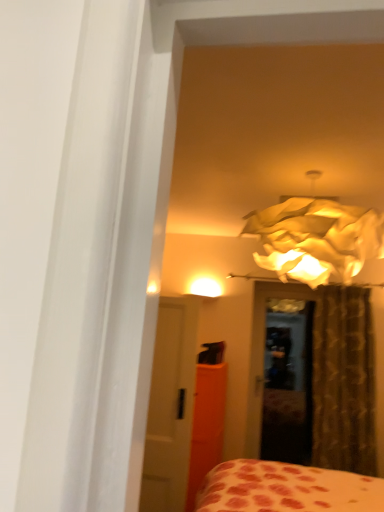
What do you see at coordinates (206, 425) in the screenshot? This screenshot has width=384, height=512. I see `orange matte armoire at center` at bounding box center [206, 425].

Find the location of a particular element. The width and height of the screenshot is (384, 512). orange matte armoire at center is located at coordinates (206, 425).

The width and height of the screenshot is (384, 512). I want to click on matte paper lampshade at upper center, so click(x=316, y=239).

This screenshot has height=512, width=384. Describe the element at coordinates (170, 406) in the screenshot. I see `white glossy door at center` at that location.

Measure the distance between brown textured curtain at right and camera.

3.46 meters.

The width and height of the screenshot is (384, 512). In order to click on orange matte armoire at center in this screenshot , I will do `click(206, 425)`.

Which object is positioned more to the left, white glossy door at center or brown textured curtain at right?

white glossy door at center.

Which is nearer, [190,437] or [355,431]?

Positioned in front is point [190,437].

Image resolution: width=384 pixels, height=512 pixels. What are the coordinates of `curtain on the right of white glossy door at center` in the screenshot? It's located at [343, 381].

Considering the sizes of objects white glossy door at center and brown textured curtain at right in the image provided, who is thinner, white glossy door at center or brown textured curtain at right?

With smaller width is white glossy door at center.

Which of these two, matte paper lampshade at upper center or orange matte armoire at center, is wider?

orange matte armoire at center is wider.

I want to click on lamp located above the orange matte armoire at center (from the image's perspective), so click(316, 239).

Could you tell me if matte paper lampshade at upper center is facing orange matte armoire at center?

No, matte paper lampshade at upper center is not turned towards orange matte armoire at center.

From a real-world perspective, between matte paper lampshade at upper center and orange matte armoire at center, who is vertically higher?

matte paper lampshade at upper center is physically above.

Measure the distance between white glossy door at center and matte paper lampshade at upper center.

white glossy door at center and matte paper lampshade at upper center are 3.99 feet apart from each other.

Considering the positions of point (156, 481) and point (258, 222), is point (156, 481) closer or farther from the camera than point (258, 222)?

Point (156, 481) is positioned farther from the camera compared to point (258, 222).

From the image's perspective, which is above, white glossy door at center or matte paper lampshade at upper center?

From the image's view, matte paper lampshade at upper center is above.

Considering the sizes of white glossy door at center and matte paper lampshade at upper center in the image, is white glossy door at center bigger or smaller than matte paper lampshade at upper center?

white glossy door at center is smaller than matte paper lampshade at upper center.

From the picture: Are brown textured curtain at right and white glossy door at center far apart?

Yes, brown textured curtain at right and white glossy door at center are located far from each other.

Does point (351, 462) lie in front of point (173, 487)?

That is False.

In terms of width, does brown textured curtain at right look wider or thinner when compared to white glossy door at center?

Considering their sizes, brown textured curtain at right looks broader than white glossy door at center.

Would you say brown textured curtain at right is inside or outside white glossy door at center?

brown textured curtain at right is not enclosed by white glossy door at center.

Is white glossy door at center aimed at orange matte armoire at center?

No, white glossy door at center is not turned towards orange matte armoire at center.

Can you confirm if white glossy door at center is shorter than orange matte armoire at center?

No, white glossy door at center is not shorter than orange matte armoire at center.

From the image's perspective, which is above, white glossy door at center or orange matte armoire at center?

white glossy door at center is shown above in the image.

From a real-world perspective, who is located lower, white glossy door at center or orange matte armoire at center?

From a 3D spatial view, orange matte armoire at center is below.

Does orange matte armoire at center come behind matte paper lampshade at upper center?

That is True.

Between orange matte armoire at center and matte paper lampshade at upper center, which one has larger size?

Bigger between the two is matte paper lampshade at upper center.

Is orange matte armoire at center wider or thinner than matte paper lampshade at upper center?

orange matte armoire at center is wider than matte paper lampshade at upper center.

You are a GUI agent. You are given a task and a screenshot of the screen. Output one action in this format:
    pyautogui.click(x=<x>, y=<y>)
    Task: Click on the armoire below the matte paper lampshade at upper center (from the image's perspective)
    
    Given the screenshot: What is the action you would take?
    pyautogui.click(x=206, y=425)

Which of these two, brown textured curtain at right or matte paper lampshade at upper center, is bigger?

With larger size is matte paper lampshade at upper center.

Between point (336, 450) and point (272, 219), which one is positioned behind?

Positioned behind is point (336, 450).

Is brown textured curtain at right positioned with its back to matte paper lampshade at upper center?

No, matte paper lampshade at upper center is not at the back of brown textured curtain at right.

From a real-world perspective, who is located lower, brown textured curtain at right or matte paper lampshade at upper center?

From a 3D spatial view, brown textured curtain at right is below.

Locate an element on the screen. This screenshot has width=384, height=512. door on the left side of brown textured curtain at right is located at coordinates (170, 406).

Locate an element on the screen. This screenshot has height=512, width=384. lamp on the right of orange matte armoire at center is located at coordinates (316, 239).

Estimate the real-world distances between objects in this image. Which object is further from orange matte armoire at center, brown textured curtain at right or matte paper lampshade at upper center?

matte paper lampshade at upper center is positioned further to the anchor orange matte armoire at center.

Based on their spatial positions, is orange matte armoire at center or brown textured curtain at right closer to matte paper lampshade at upper center?

brown textured curtain at right.

When comparing their distances from orange matte armoire at center, does matte paper lampshade at upper center or brown textured curtain at right seem further?

Among the two, matte paper lampshade at upper center is located further to orange matte armoire at center.

Estimate the real-world distances between objects in this image. Which object is further from orange matte armoire at center, brown textured curtain at right or white glossy door at center?

brown textured curtain at right is positioned further to the anchor orange matte armoire at center.

When comparing their distances from white glossy door at center, does matte paper lampshade at upper center or orange matte armoire at center seem further?

matte paper lampshade at upper center.

Estimate the real-world distances between objects in this image. Which object is further from brown textured curtain at right, orange matte armoire at center or white glossy door at center?

white glossy door at center lies further to brown textured curtain at right than the other object.

Estimate the real-world distances between objects in this image. Which object is closer to matte paper lampshade at upper center, orange matte armoire at center or white glossy door at center?

The object closer to matte paper lampshade at upper center is white glossy door at center.

When comparing their distances from brown textured curtain at right, does orange matte armoire at center or matte paper lampshade at upper center seem closer?

The object closer to brown textured curtain at right is orange matte armoire at center.

I want to click on armoire between white glossy door at center and brown textured curtain at right from left to right, so click(206, 425).

At what (x,y) coordinates should I click in order to perform the action: click on armoire located between matte paper lampshade at upper center and brown textured curtain at right in the depth direction. Please return your answer as a coordinate pair (x, y). Looking at the image, I should click on (206, 425).

Identify the location of door between matte paper lampshade at upper center and brown textured curtain at right along the z-axis. This screenshot has height=512, width=384. 170,406.

What are the coordinates of `door between matte paper lampshade at upper center and orange matte armoire at center in the up-down direction` in the screenshot? It's located at (170, 406).